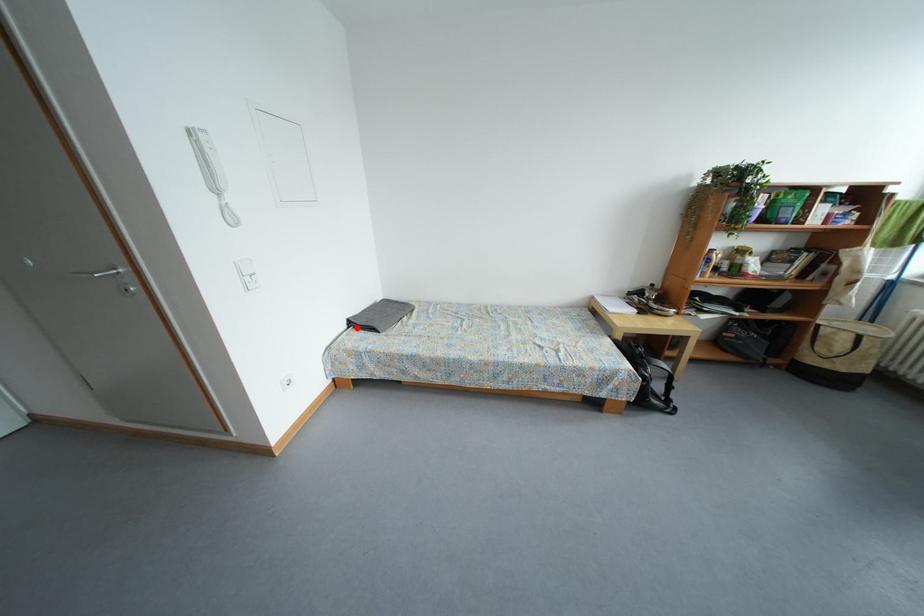
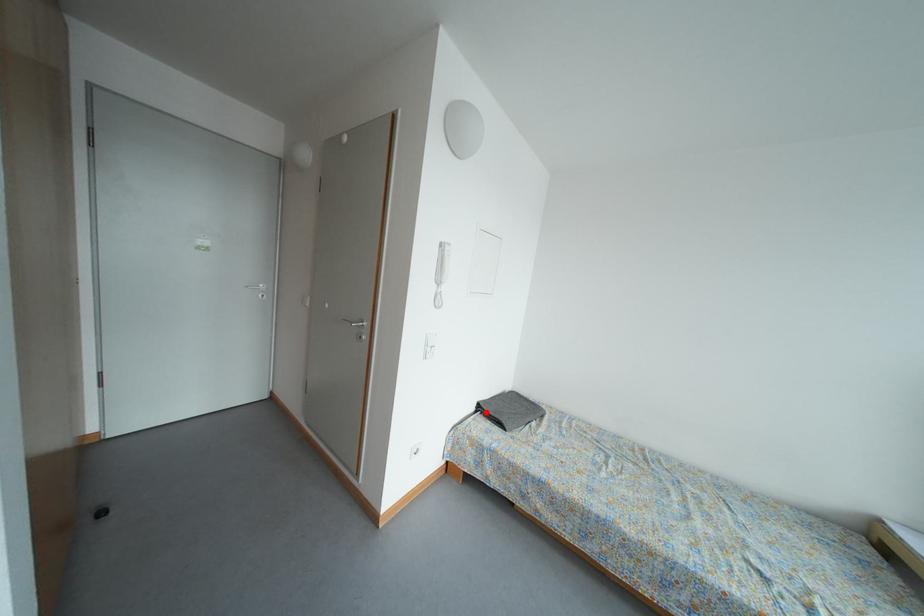
I am providing you with two images of the same scene from different viewpoints. A red point is marked on the first image and another point is marked on the second image. Do the highlighted points in image1 and image2 indicate the same real-world spot?

Yes